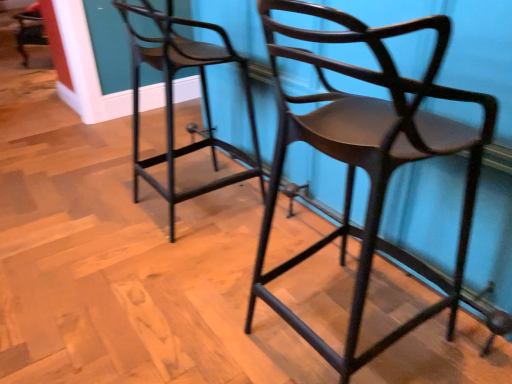
The width and height of the screenshot is (512, 384). Find the location of `free space to the left of matte dark wood chair at center, which is counted as the second chair, starting from the left`. free space to the left of matte dark wood chair at center, which is counted as the second chair, starting from the left is located at coordinates (192, 322).